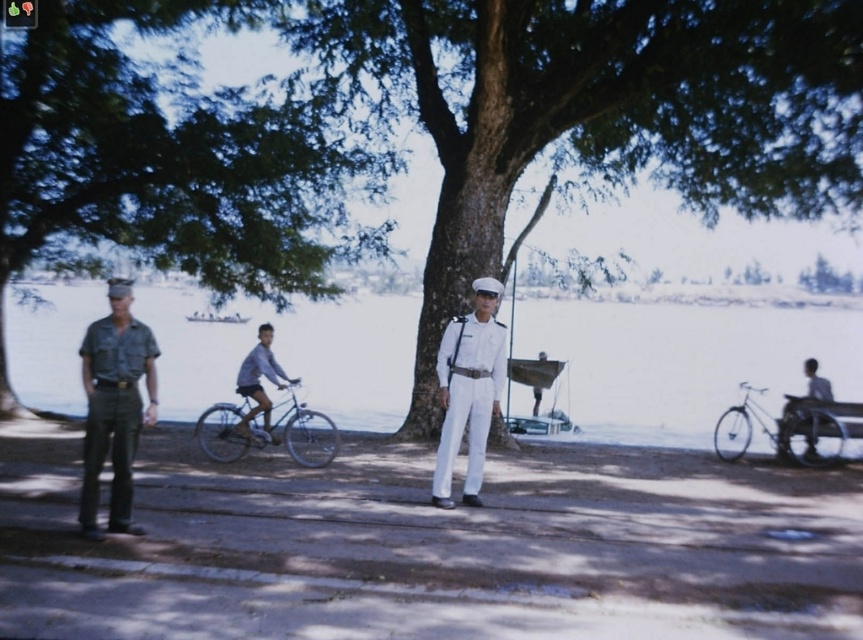
Can you confirm if green leafy tree at center is positioned to the right of light blue fabric shirt at center?

Yes, green leafy tree at center is to the right of light blue fabric shirt at center.

Who is more forward, (758, 8) or (271, 376)?

Point (271, 376) is more forward.

You are a GUI agent. You are given a task and a screenshot of the screen. Output one action in this format:
    pyautogui.click(x=<x>, y=<y>)
    Task: Click on the green leafy tree at center
    
    Given the screenshot: What is the action you would take?
    pyautogui.click(x=597, y=109)

Is green leafy tree at center to the right of wooden park bench at right from the viewer's perspective?

Incorrect, green leafy tree at center is not on the right side of wooden park bench at right.

Image resolution: width=863 pixels, height=640 pixels. What are the coordinates of `green leafy tree at center` in the screenshot? It's located at pyautogui.click(x=597, y=109).

Between green leafy tree at upper left and light blue fabric shirt at center, which one is positioned higher?

green leafy tree at upper left is above.

Is green leafy tree at upper left behind light blue fabric shirt at center?

Yes, green leafy tree at upper left is further from the viewer.

Measure the distance between green leafy tree at upper left and camera.

green leafy tree at upper left is 18.95 meters away from camera.

At what (x,y) coordinates should I click in order to perform the action: click on green leafy tree at upper left. Please return your answer as a coordinate pair (x, y). Looking at the image, I should click on (167, 161).